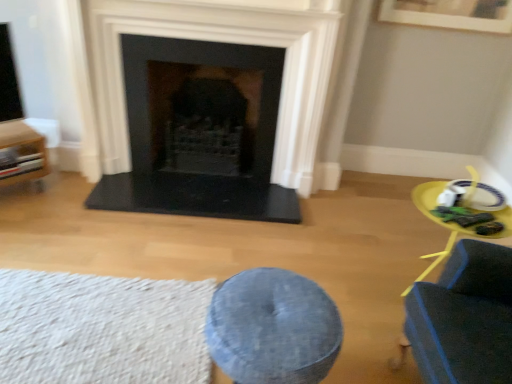
The image size is (512, 384). What do you see at coordinates (102, 329) in the screenshot?
I see `white textured rug at lower left` at bounding box center [102, 329].

What do you see at coordinates (273, 328) in the screenshot? I see `denim cushion at center` at bounding box center [273, 328].

In order to face black stone fireplace at center, should I rotate leftwards or rightwards?

You should look left and rotate roughly 7.056 degrees.

Where is `white textured rug at lower left`? This screenshot has width=512, height=384. white textured rug at lower left is located at coordinates (102, 329).

This screenshot has width=512, height=384. I want to click on plain that is on the left side of denim cushion at center, so click(x=102, y=329).

Does denim cushion at center have a larger size compared to white textured rug at lower left?

Yes.

Is denim cushion at center with white textured rug at lower left?

No, denim cushion at center is not in contact with white textured rug at lower left.

Is denim cushion at center aimed at white textured rug at lower left?

Yes, denim cushion at center is aimed at white textured rug at lower left.

Is black stone fireplace at center to the left or to the right of white textured rug at lower left in the image?

black stone fireplace at center is positioned on white textured rug at lower left's right side.

The image size is (512, 384). In order to click on fireplace above the white textured rug at lower left (from a real-world perspective) in this screenshot , I will do `click(209, 105)`.

Is there a large distance between black stone fireplace at center and white textured rug at lower left?

black stone fireplace at center is far away from white textured rug at lower left.

Can you confirm if black stone fireplace at center is shorter than white textured rug at lower left?

In fact, black stone fireplace at center may be taller than white textured rug at lower left.

Identify the location of bar stool located on the right of wooden cabinet at left. (273, 328).

Could you tell me if denim cushion at center is turned towards wooden cabinet at left?

No, denim cushion at center does not turn towards wooden cabinet at left.

Which object is closer to the camera, denim cushion at center or wooden cabinet at left?

denim cushion at center is closer to the camera.

Which is behind, point (331, 306) or point (2, 140)?

The point (2, 140) is more distant.

Where is `bar stool on the right of wooden cabinet at left`? bar stool on the right of wooden cabinet at left is located at coordinates (273, 328).

Considering the sizes of objects wooden cabinet at left and denim cushion at center in the image provided, who is taller, wooden cabinet at left or denim cushion at center?

denim cushion at center is taller.

From the image's perspective, is wooden cabinet at left located above or below denim cushion at center?

wooden cabinet at left is situated higher than denim cushion at center in the image.

Considering the positions of point (14, 180) and point (276, 275), is point (14, 180) closer or farther from the camera than point (276, 275)?

Point (14, 180).

Is yellow plastic table at right facing away from wooden cabinet at left?

No, yellow plastic table at right is not facing the opposite direction of wooden cabinet at left.

Considering the relative positions of yellow plastic table at right and wooden cabinet at left in the image provided, is yellow plastic table at right to the right of wooden cabinet at left from the viewer's perspective?

Yes, yellow plastic table at right is to the right of wooden cabinet at left.

Can we say yellow plastic table at right lies outside wooden cabinet at left?

Yes.

The width and height of the screenshot is (512, 384). What are the coordinates of `plain that appears below the yellow plastic table at right (from a real-world perspective)` in the screenshot? It's located at (102, 329).

Considering the sizes of white textured rug at lower left and yellow plastic table at right in the image, is white textured rug at lower left wider or thinner than yellow plastic table at right?

In the image, white textured rug at lower left appears to be wider than yellow plastic table at right.

Would you say white textured rug at lower left is inside or outside yellow plastic table at right?

white textured rug at lower left is outside yellow plastic table at right.

Is white textured rug at lower left oriented towards yellow plastic table at right?

No, white textured rug at lower left does not turn towards yellow plastic table at right.

Is white textured rug at lower left far from black stone fireplace at center?

Indeed, white textured rug at lower left is not near black stone fireplace at center.

Is white textured rug at lower left situated inside black stone fireplace at center or outside?

white textured rug at lower left is located beyond the bounds of black stone fireplace at center.

Is white textured rug at lower left facing away from black stone fireplace at center?

Absolutely, white textured rug at lower left is directed away from black stone fireplace at center.

From a real-world perspective, is white textured rug at lower left above or below black stone fireplace at center?

Clearly, from a real-world perspective, white textured rug at lower left is below black stone fireplace at center.

The height and width of the screenshot is (384, 512). I want to click on plain on the left of the denim cushion at center, so click(102, 329).

Image resolution: width=512 pixels, height=384 pixels. I want to click on fireplace that appears behind the white textured rug at lower left, so click(x=209, y=105).

Estimate the real-world distances between objects in this image. Which object is closer to black stone fireplace at center, yellow plastic table at right or wooden cabinet at left?

wooden cabinet at left is positioned closer to the anchor black stone fireplace at center.

Which object lies further to the anchor point yellow plastic table at right, black stone fireplace at center or denim cushion at center?

black stone fireplace at center is positioned further to the anchor yellow plastic table at right.

Consider the image. Considering their positions, is yellow plastic table at right positioned further to white textured rug at lower left than denim cushion at center?

yellow plastic table at right.

Considering their positions, is denim cushion at center positioned closer to black stone fireplace at center than yellow plastic table at right?

Among the two, denim cushion at center is located nearer to black stone fireplace at center.

From the image, which object appears to be nearer to wooden cabinet at left, white textured rug at lower left or black stone fireplace at center?

black stone fireplace at center is closer to wooden cabinet at left.

Estimate the real-world distances between objects in this image. Which object is closer to wooden cabinet at left, black stone fireplace at center or denim cushion at center?

Among the two, black stone fireplace at center is located nearer to wooden cabinet at left.

Which object lies further to the anchor point denim cushion at center, black stone fireplace at center or wooden cabinet at left?

wooden cabinet at left lies further to denim cushion at center than the other object.

Considering their positions, is denim cushion at center positioned further to wooden cabinet at left than white textured rug at lower left?

denim cushion at center is positioned further to the anchor wooden cabinet at left.

This screenshot has height=384, width=512. In order to click on plain that lies between black stone fireplace at center and denim cushion at center from top to bottom in this screenshot , I will do `click(102, 329)`.

Locate an element on the screen. The width and height of the screenshot is (512, 384). bar stool between black stone fireplace at center and yellow plastic table at right from left to right is located at coordinates coord(273,328).

This screenshot has height=384, width=512. In order to click on bar stool located between white textured rug at lower left and yellow plastic table at right in the left-right direction in this screenshot , I will do `click(273, 328)`.

The image size is (512, 384). What are the coordinates of `plain between wooden cabinet at left and yellow plastic table at right in the horizontal direction` in the screenshot? It's located at (102, 329).